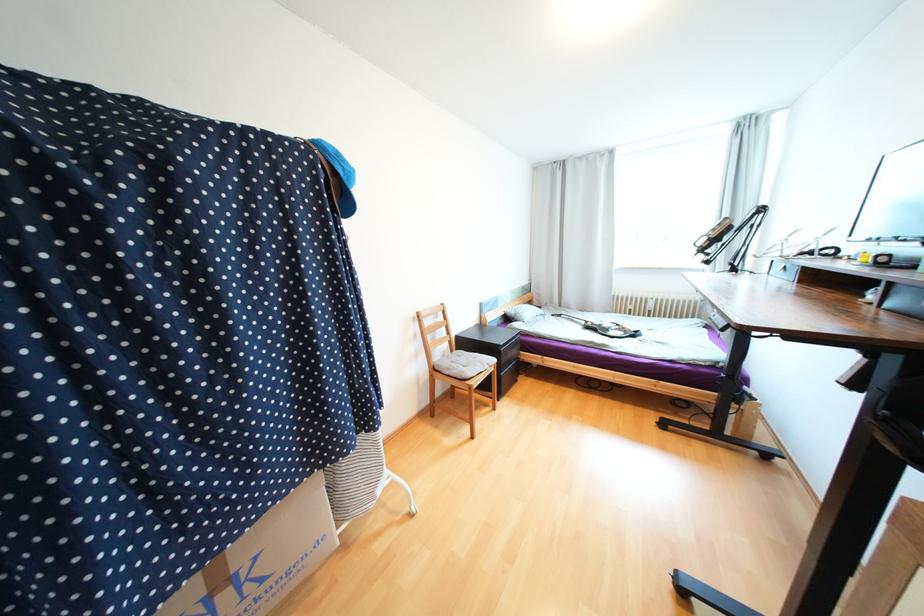
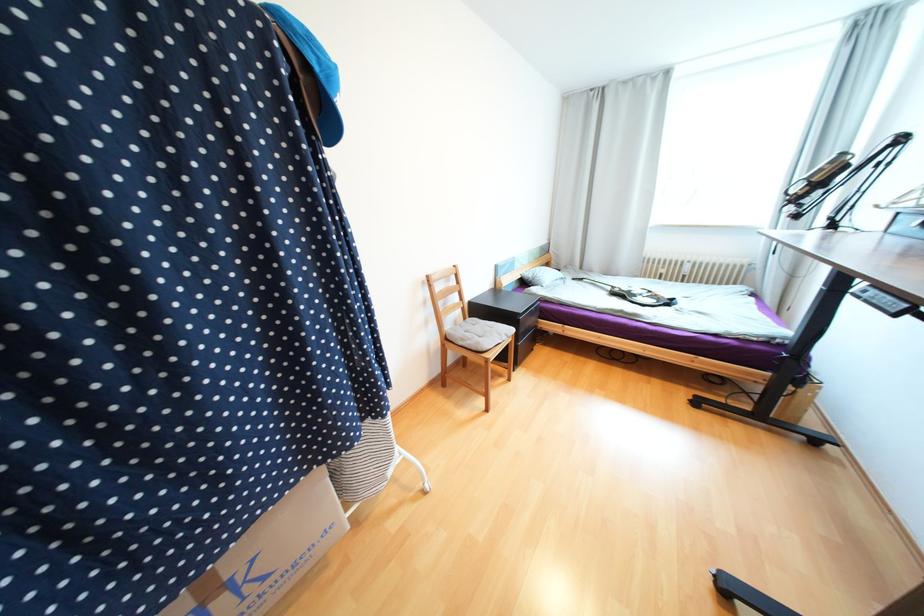
The point at (342, 174) is marked in the first image. Where is the corresponding point in the second image?

(312, 67)